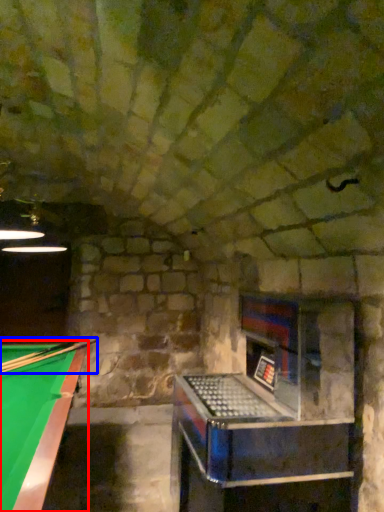
Question: Which object is closer to the camera taking this photo, billiard table (highlighted by a red box) or cue (highlighted by a blue box)?

Choices:
 (A) billiard table
 (B) cue

Answer: (A)